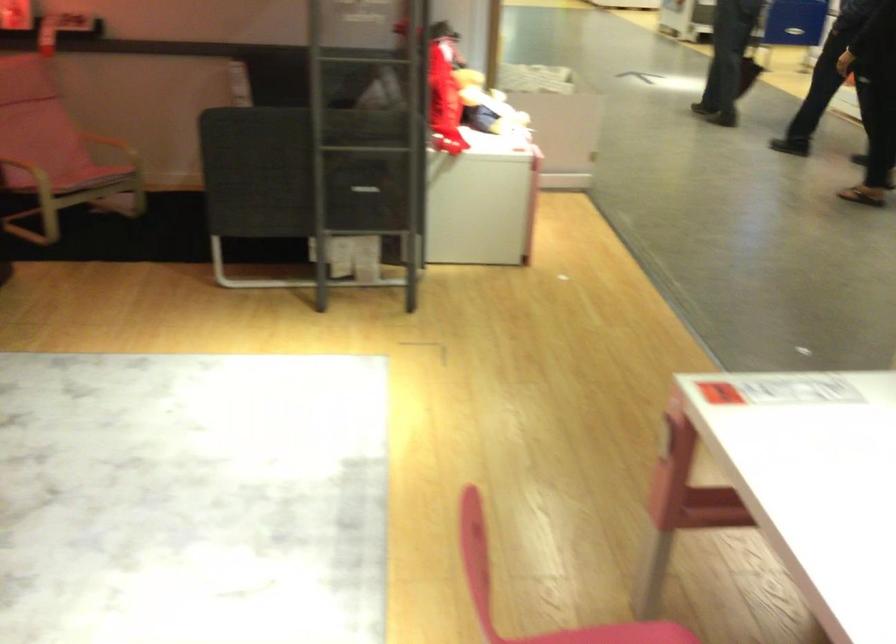
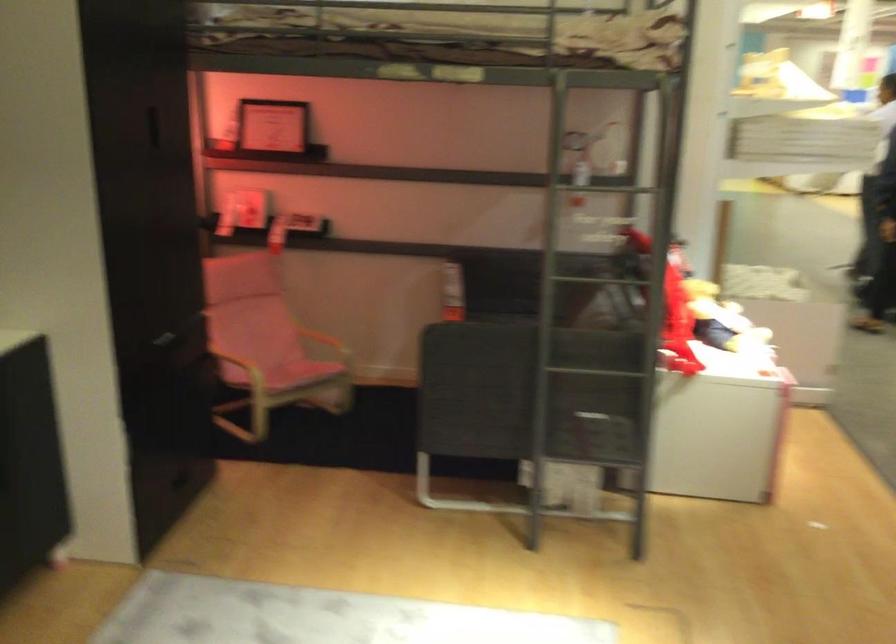
Find the pixel in the second image that matches pixel 243 91 in the first image.

(452, 292)